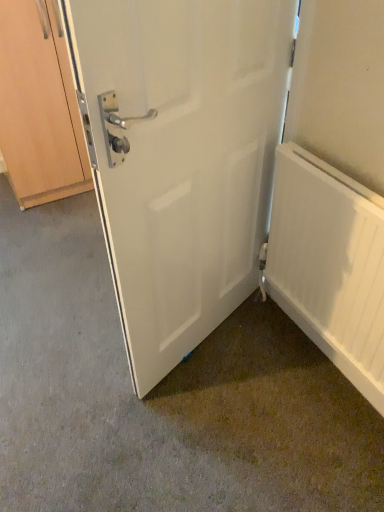
Question: Considering the relative sizes of wooden cabinet at left and white matte door at center in the image provided, is wooden cabinet at left shorter than white matte door at center?

Choices:
 (A) yes
 (B) no

Answer: (A)

Question: Can you confirm if wooden cabinet at left is smaller than white matte door at center?

Choices:
 (A) no
 (B) yes

Answer: (A)

Question: Is wooden cabinet at left in contact with white matte door at center?

Choices:
 (A) yes
 (B) no

Answer: (B)

Question: Does wooden cabinet at left have a greater width compared to white matte door at center?

Choices:
 (A) yes
 (B) no

Answer: (A)

Question: From a real-world perspective, is wooden cabinet at left positioned under white matte door at center based on gravity?

Choices:
 (A) yes
 (B) no

Answer: (A)

Question: From the image's perspective, is wooden cabinet at left beneath white matte door at center?

Choices:
 (A) no
 (B) yes

Answer: (A)

Question: Are white matte door at center and wooden cabinet at left far apart?

Choices:
 (A) no
 (B) yes

Answer: (B)

Question: Considering the relative sizes of white matte door at center and wooden cabinet at left in the image provided, is white matte door at center thinner than wooden cabinet at left?

Choices:
 (A) no
 (B) yes

Answer: (B)

Question: Is white matte door at center further to camera compared to wooden cabinet at left?

Choices:
 (A) no
 (B) yes

Answer: (A)

Question: Could you tell me if white matte door at center is facing wooden cabinet at left?

Choices:
 (A) yes
 (B) no

Answer: (A)

Question: Considering the relative positions of white matte door at center and wooden cabinet at left in the image provided, is white matte door at center to the left of wooden cabinet at left from the viewer's perspective?

Choices:
 (A) no
 (B) yes

Answer: (A)

Question: From the image's perspective, is white matte door at center located above wooden cabinet at left?

Choices:
 (A) yes
 (B) no

Answer: (B)

Question: Considering the relative sizes of white matte radiator at right and white matte door at center in the image provided, is white matte radiator at right smaller than white matte door at center?

Choices:
 (A) yes
 (B) no

Answer: (A)